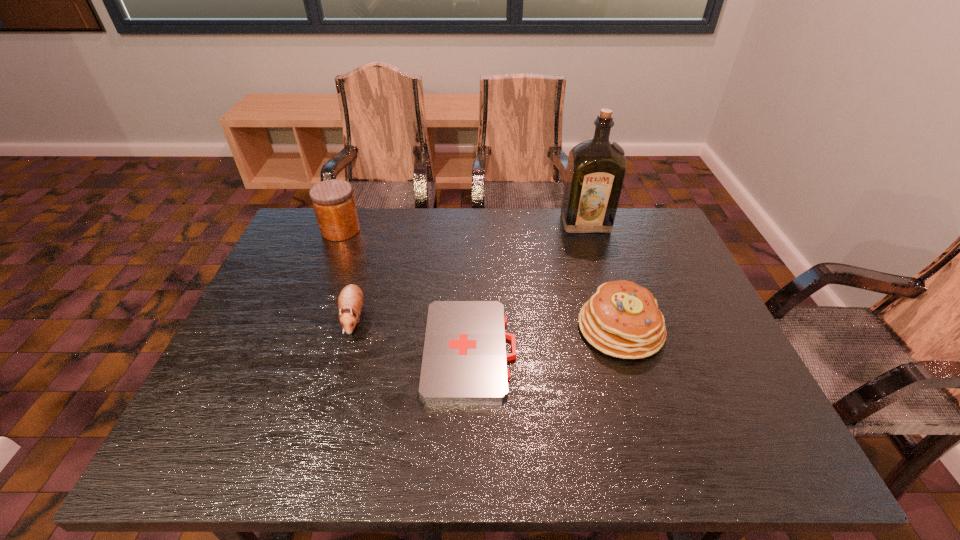
Find the location of a particular element. liquor is located at coordinates (596, 168).

Locate an element on the screen. The height and width of the screenshot is (540, 960). jar is located at coordinates (333, 201).

Image resolution: width=960 pixels, height=540 pixels. In order to click on the leftmost object in this screenshot , I will do `click(333, 201)`.

Find the location of a particular element. the third tallest object is located at coordinates (622, 319).

The height and width of the screenshot is (540, 960). Identify the location of the second shortest object. (350, 301).

Locate an element on the screen. The image size is (960, 540). the second object from left to right is located at coordinates (350, 301).

Locate an element on the screen. the first-aid kit is located at coordinates (464, 359).

Find the location of a particular element. the shortest object is located at coordinates (464, 359).

Where is `vacant space located 0.390m on the label of the liquor`? vacant space located 0.390m on the label of the liquor is located at coordinates (617, 328).

Image resolution: width=960 pixels, height=540 pixels. What are the coordinates of `free location located 0.180m on the front of the leftmost object` in the screenshot? It's located at (321, 281).